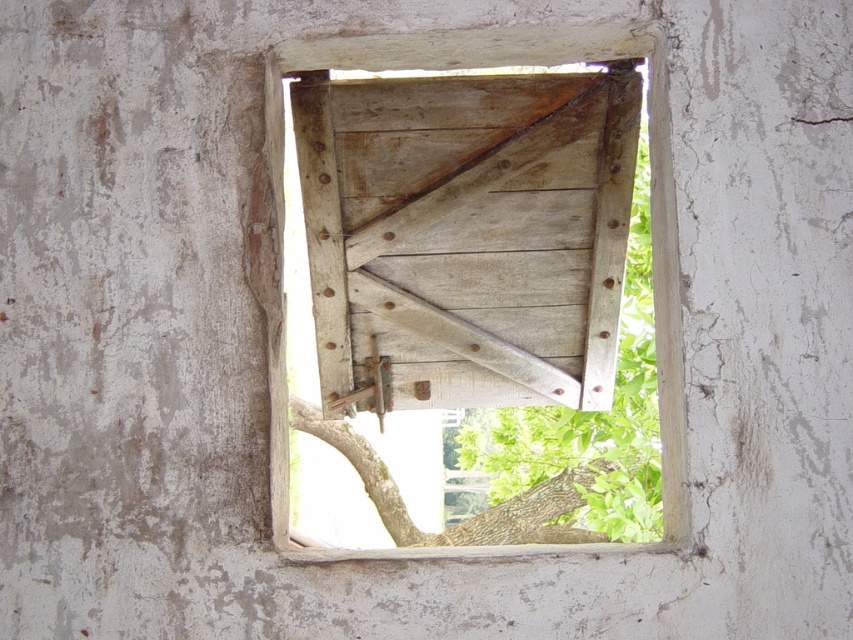
You are standing in front of the weathered wooden window shutter. You notice the wooden frame at center and the wooden hinge at center. Which object is positioned to the right of the other?

The wooden frame at center is to the right of wooden hinge at center.

You are an architect inspecting an old building. You notice the wooden frame at center and the wooden hinge at center. Which one has a greater height?

The wooden frame at center is taller than the wooden hinge at center according to the description.

You are standing in front of the weathered wooden window shutter. There are two points on the shutter labeled as point [440,157] and point [328,182]. Which point is closer to you?

Point [328,182] is closer to you because it is less further to the camera than point [440,157].